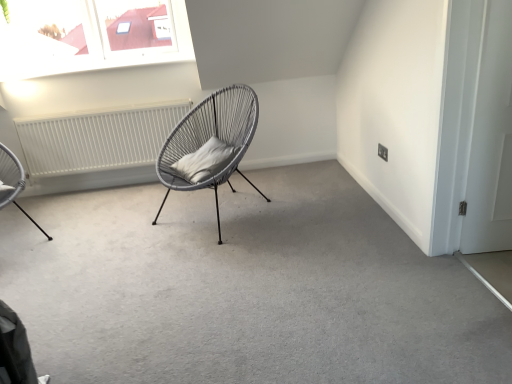
Question: Is gray fabric pillow at center at the right side of white matte radiator at left?

Choices:
 (A) yes
 (B) no

Answer: (A)

Question: From a real-world perspective, is gray fabric pillow at center positioned under white matte radiator at left based on gravity?

Choices:
 (A) no
 (B) yes

Answer: (A)

Question: From the image's perspective, is gray fabric pillow at center above white matte radiator at left?

Choices:
 (A) no
 (B) yes

Answer: (A)

Question: Does gray fabric pillow at center turn towards white matte radiator at left?

Choices:
 (A) no
 (B) yes

Answer: (A)

Question: Does gray fabric pillow at center lie behind white matte radiator at left?

Choices:
 (A) yes
 (B) no

Answer: (B)

Question: From a real-world perspective, is gray fabric pillow at center positioned over white matte radiator at left based on gravity?

Choices:
 (A) no
 (B) yes

Answer: (B)

Question: Can you confirm if metallic wire chair at left, which is the 1th chair from left to right, is wider than matte grey wicker chair at center, which is counted as the 1th chair, starting from the right?

Choices:
 (A) yes
 (B) no

Answer: (B)

Question: Considering the relative sizes of metallic wire chair at left, which is the second chair from right to left, and matte grey wicker chair at center, which appears as the 2th chair when viewed from the left, in the image provided, is metallic wire chair at left, which is the second chair from right to left, bigger than matte grey wicker chair at center, which appears as the 2th chair when viewed from the left,?

Choices:
 (A) yes
 (B) no

Answer: (B)

Question: Can you confirm if metallic wire chair at left, which is the 1th chair from left to right, is positioned to the right of matte grey wicker chair at center, which is counted as the 1th chair, starting from the right?

Choices:
 (A) no
 (B) yes

Answer: (A)

Question: Is the depth of metallic wire chair at left, which is the 1th chair from left to right, greater than that of matte grey wicker chair at center, which appears as the 2th chair when viewed from the left?

Choices:
 (A) no
 (B) yes

Answer: (B)

Question: From the image's perspective, is metallic wire chair at left, which is the second chair from right to left, beneath matte grey wicker chair at center, which appears as the 2th chair when viewed from the left?

Choices:
 (A) no
 (B) yes

Answer: (B)

Question: From the image's perspective, is metallic wire chair at left, which is the 1th chair from left to right, above matte grey wicker chair at center, which appears as the 2th chair when viewed from the left?

Choices:
 (A) no
 (B) yes

Answer: (A)

Question: Is gray fabric pillow at center looking in the opposite direction of metallic wire chair at left, which is the second chair from right to left?

Choices:
 (A) yes
 (B) no

Answer: (B)